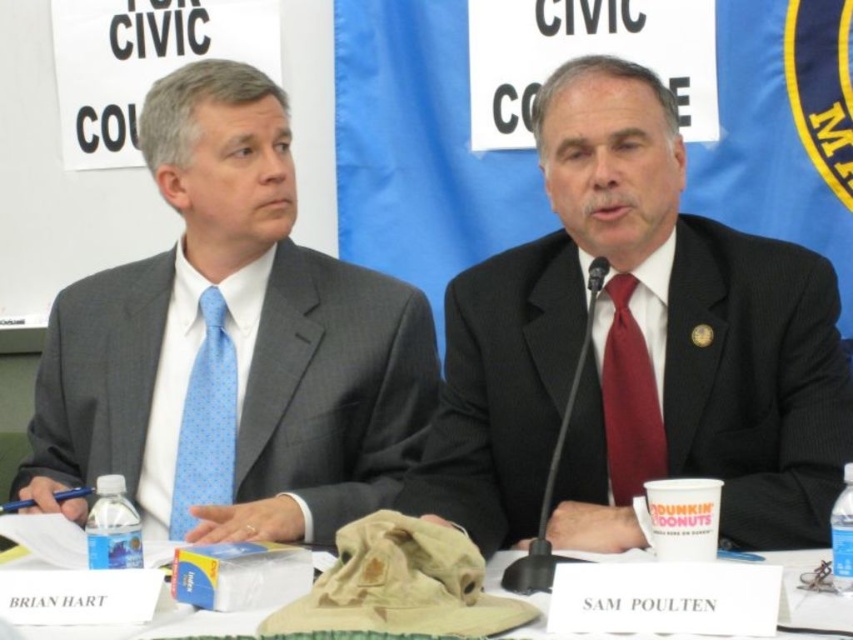
You are organizing a photo shoot and need to ensure that the matte black suit at center and the white paper at center are visible in the frame. Based on their sizes, which object should you focus on to ensure both are in the shot?

The matte black suit at center is much taller than the white paper at center, so focusing on the taller matte black suit at center will help ensure both are visible in the frame.

You are an event planner organizing a photoshoot for this formal event. You need to place a decorative centerpiece exactly at the point labeled as point (x=635, y=349). Which object from the scene will this centerpiece be placed in front of or near?

The point (x=635, y=349) indicates the matte black suit at center, so the decorative centerpiece will be placed near the matte black suit at center.

You are a photographer taking a picture of the two men at the table. You want to ensure the matte gray suit at center and the blue dotted tie at left are both clearly visible in the frame. Given their distance apart, will you need to adjust your camera to focus on both objects simultaneously?

The matte gray suit at center is 5.50 inches away from the blue dotted tie at left. Since they are only 5.50 inches apart, the camera should be able to focus on both objects simultaneously without needing adjustment, as this distance is within typical depth of field for most camera settings.